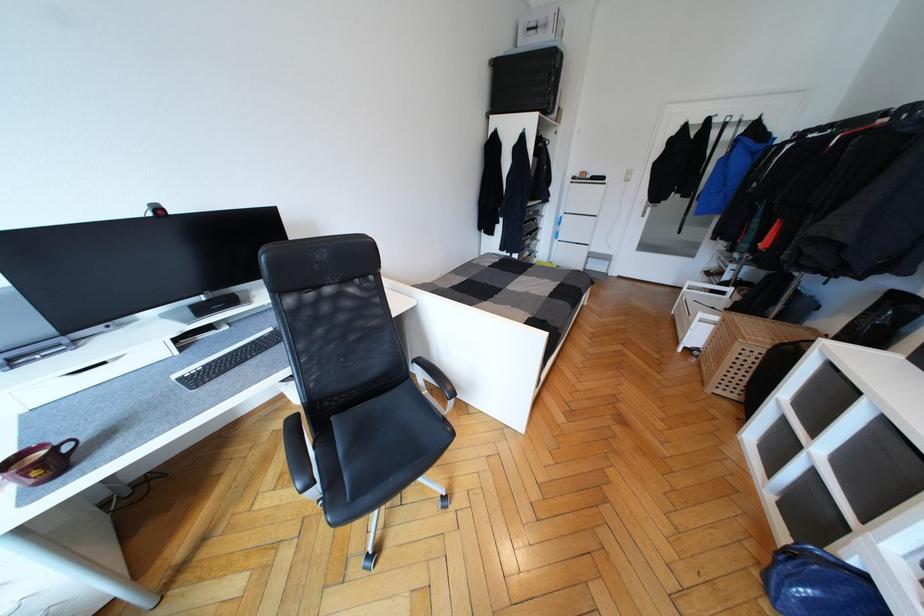
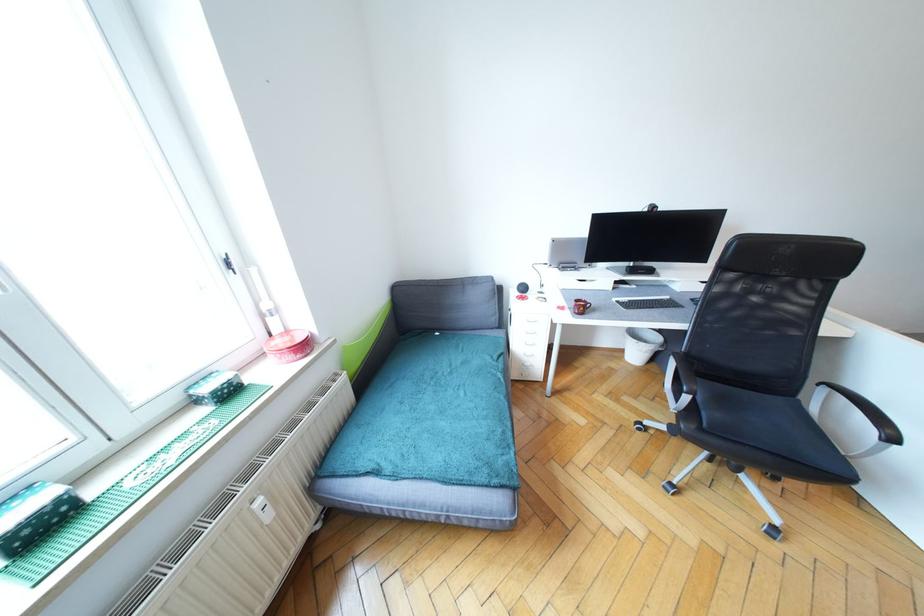
Question: I am providing you with two images of the same scene from different viewpoints. After the viewpoint changes to image2, which objects are now occluded?

Choices:
 (A) white spray bottle
 (B) chair sitting surface
 (C) white trash can
 (D) none of these

Answer: (D)